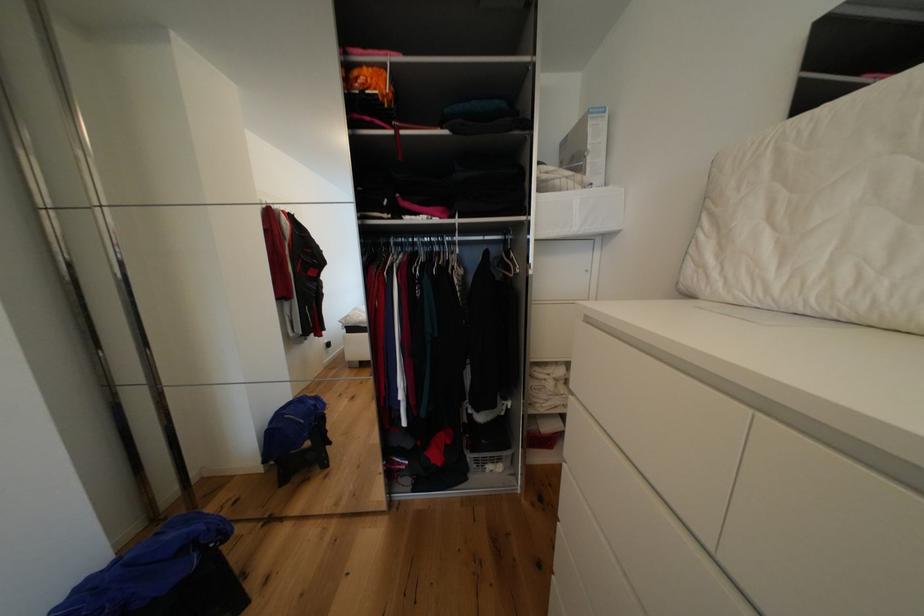
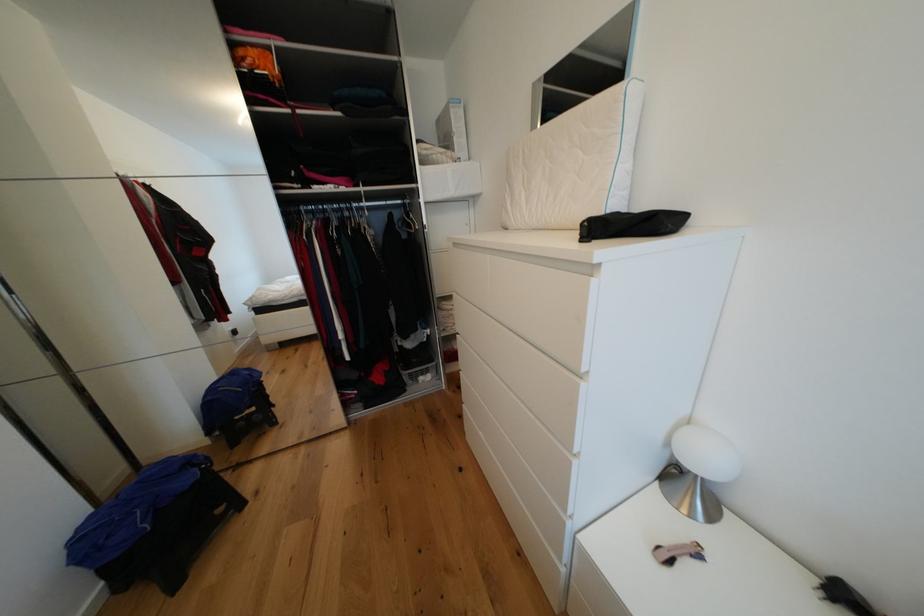
Question: What movement of the cameraman would produce the second image?

Choices:
 (A) Left
 (B) Right
 (C) Forward
 (D) Backward

Answer: (D)